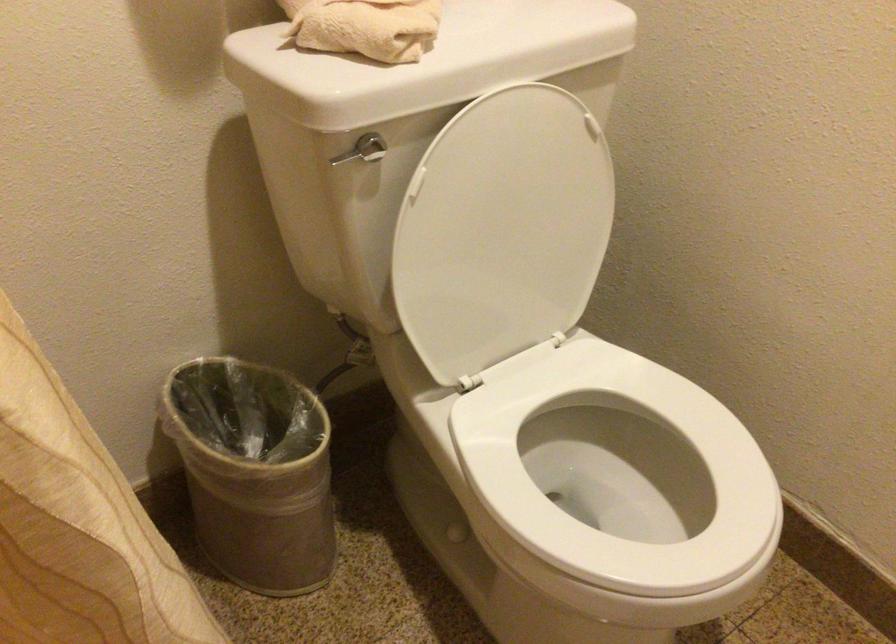
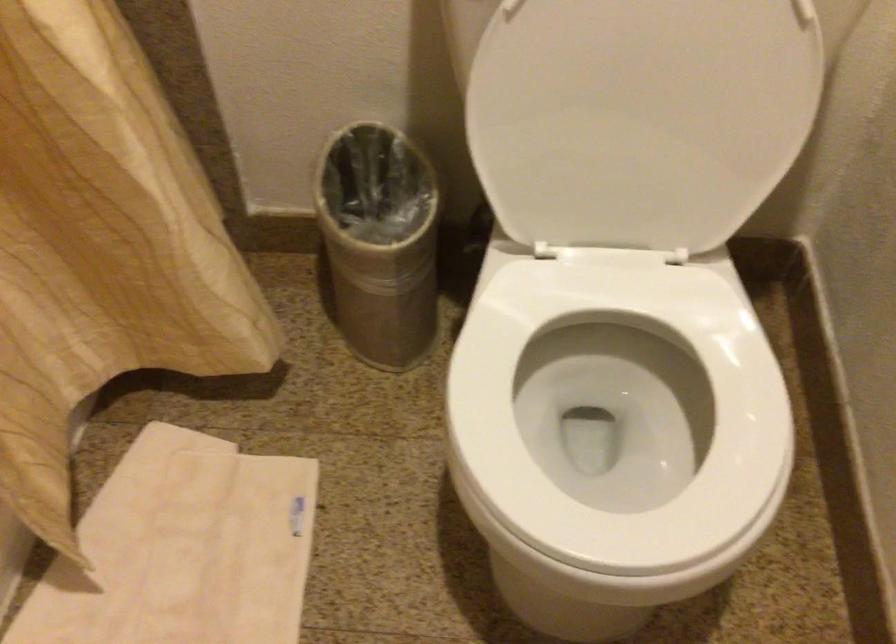
First-person continuous shooting, in which direction is the camera rotating?

The rotation direction of the camera is left-down.